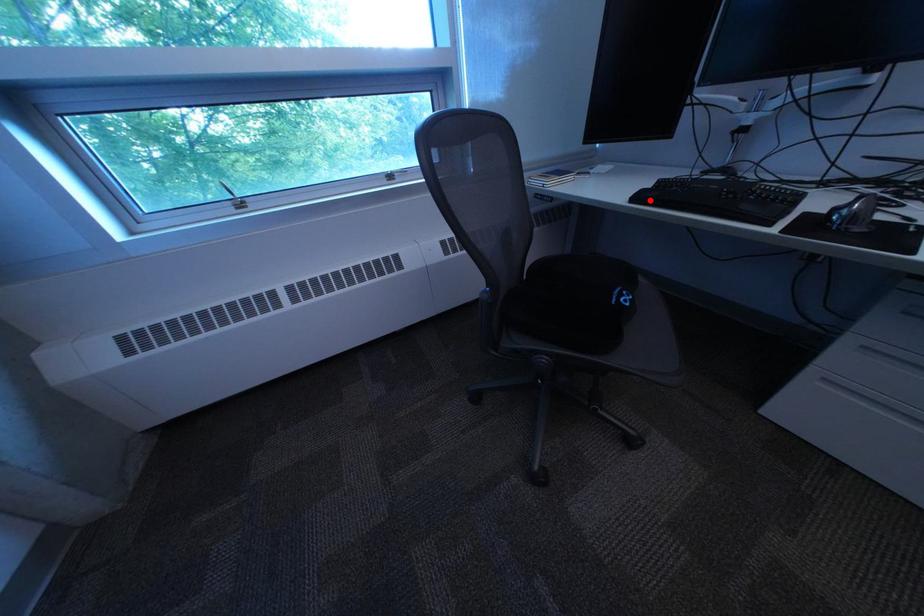
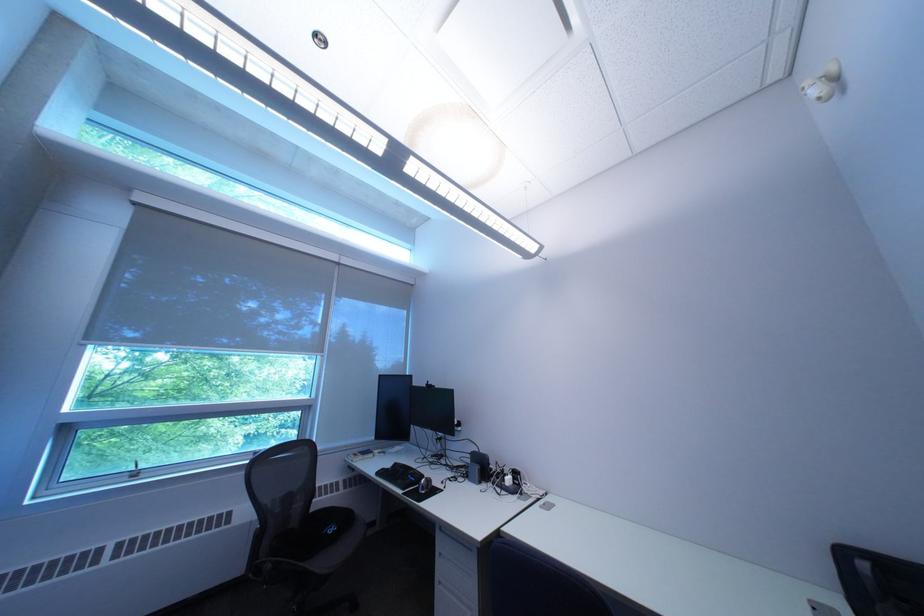
Question: I am providing you with two images of the same scene from different viewpoints. A red point is marked on the first image. Can you still see the location of the red point in image 2?

Choices:
 (A) Yes
 (B) No

Answer: (A)